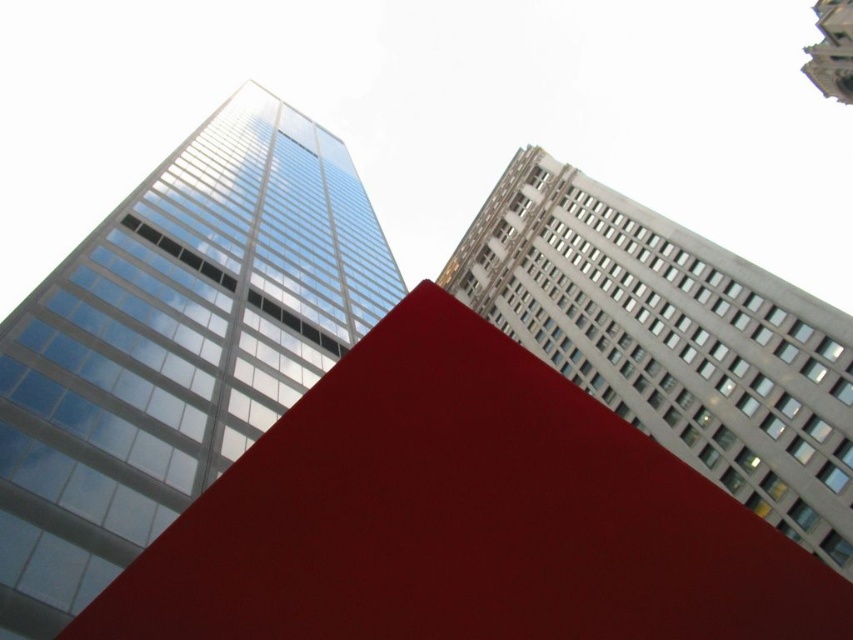
You are an architect evaluating the urban layout. The city council wants to install a large billboard on the side of the glassy reflective skyscraper at left and the smooth stone tower at upper right. Which structure would allow the billboard to be more visible from the street below?

The glassy reflective skyscraper at left is larger in size than the smooth stone tower at upper right, so the billboard placed on the glassy reflective skyscraper at left would be more visible from the street below due to its greater size providing a larger surface area for visibility.

You are an architect analyzing the urban layout. Based on the scene, which structure is positioned to the left of the other between the glassy reflective skyscraper at left and the smooth stone tower at upper right?

The glassy reflective skyscraper at left is to the left of the smooth stone tower at upper right.